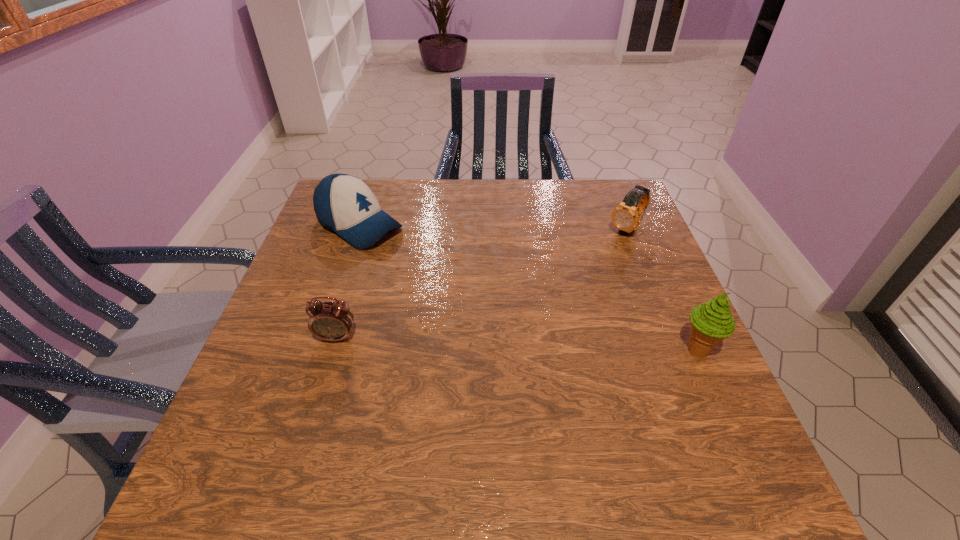
This screenshot has height=540, width=960. What are the coordinates of `free space between the watch and the baseball cap` in the screenshot? It's located at (493, 227).

You are a GUI agent. You are given a task and a screenshot of the screen. Output one action in this format:
    pyautogui.click(x=<x>, y=<y>)
    Task: Click on the vacant area between the alarm clock and the icecream
    
    Given the screenshot: What is the action you would take?
    pyautogui.click(x=516, y=344)

This screenshot has height=540, width=960. Find the location of `vacant region between the watch and the icecream`. vacant region between the watch and the icecream is located at coordinates (661, 289).

This screenshot has width=960, height=540. Identify the location of vacant area that lies between the watch and the tallest object. coord(661,289).

Identify the location of vacant space in between the baseball cap and the alarm clock. click(348, 281).

The height and width of the screenshot is (540, 960). Identify the location of object that can be found as the second closest to the alarm clock. (712, 322).

You are a GUI agent. You are given a task and a screenshot of the screen. Output one action in this format:
    pyautogui.click(x=<x>, y=<y>)
    Task: Click on the object that is the closest one to the icecream
    This screenshot has width=960, height=540.
    Given the screenshot: What is the action you would take?
    pyautogui.click(x=626, y=216)

The width and height of the screenshot is (960, 540). In order to click on free space that satisfies the following two spatial constraints: 1. on the face of the alarm clock; 2. on the left side of the icecream in this screenshot , I will do `click(333, 350)`.

The height and width of the screenshot is (540, 960). I want to click on vacant area in the image that satisfies the following two spatial constraints: 1. on the front side of the baseball cap; 2. on the left side of the tallest object, so click(318, 350).